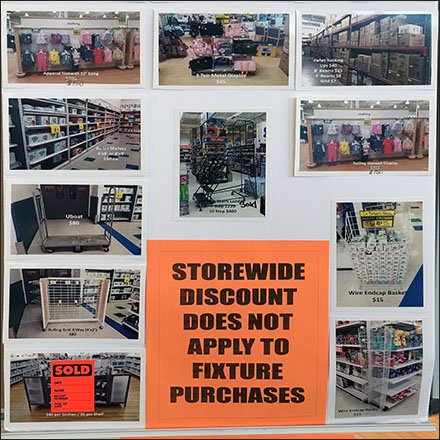
Locate an element on the screen. This screenshot has width=440, height=440. box is located at coordinates (415, 41).